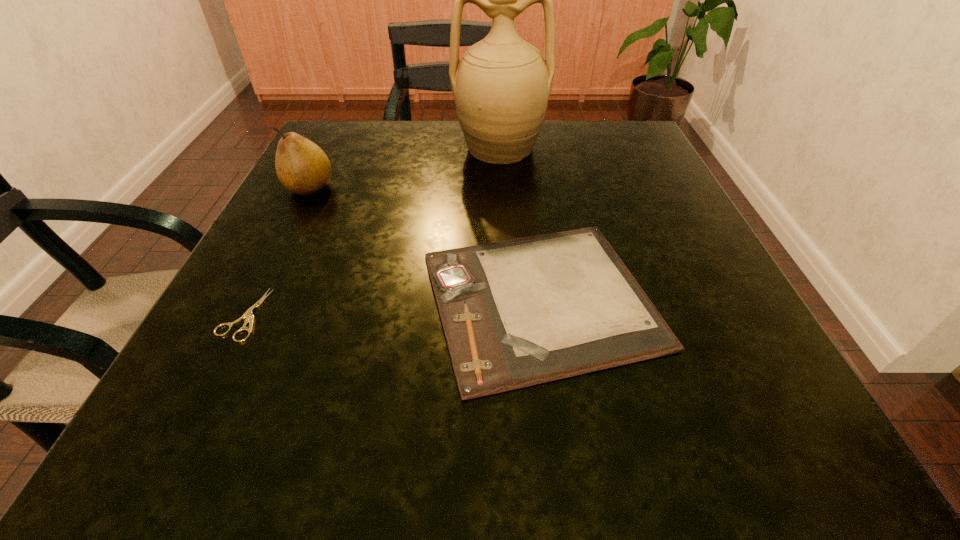
At what (x,y) coordinates should I click in order to perform the action: click on vacant space at the far right corner of the desktop. Please return your answer as a coordinate pair (x, y). Looking at the image, I should click on (592, 143).

The height and width of the screenshot is (540, 960). Find the location of `vacant space at the near right corner`. vacant space at the near right corner is located at coordinates (720, 423).

In order to click on free point between the second tallest object and the second shortest object in this screenshot , I will do `click(425, 244)`.

You are a GUI agent. You are given a task and a screenshot of the screen. Output one action in this format:
    pyautogui.click(x=<x>, y=<y>)
    Task: Click on the empty space between the second shortest object and the shortest object
    The image size is (960, 540).
    Given the screenshot: What is the action you would take?
    pyautogui.click(x=392, y=307)

At what (x,y) coordinates should I click in order to perform the action: click on blank region between the shortest object and the pitcher. Please return your answer as a coordinate pair (x, y). This screenshot has height=540, width=960. Looking at the image, I should click on (372, 232).

Where is `blank region between the shortest object and the pear`? The image size is (960, 540). blank region between the shortest object and the pear is located at coordinates (276, 251).

In order to click on empty location between the clipboard and the shortest object in this screenshot , I will do `click(392, 307)`.

At what (x,y) coordinates should I click in order to perform the action: click on empty space between the pitcher and the shortest object. Please return your answer as a coordinate pair (x, y). This screenshot has width=960, height=540. Looking at the image, I should click on click(372, 232).

Where is `vacant point located between the third tallest object and the farthest object`? vacant point located between the third tallest object and the farthest object is located at coordinates (520, 224).

The image size is (960, 540). I want to click on vacant space in between the pear and the shortest object, so click(x=276, y=251).